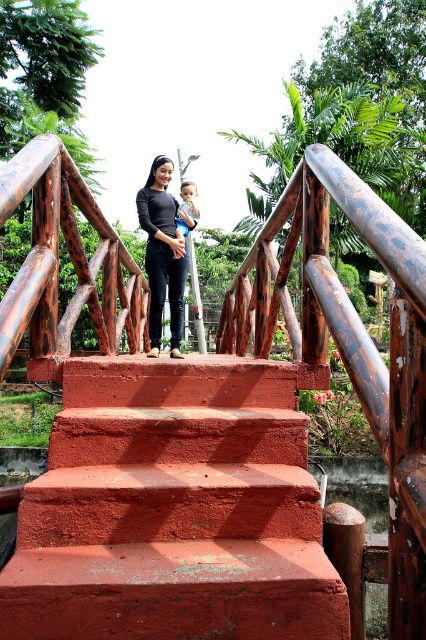
Question: Observing the image, what is the correct spatial positioning of black matte shirt at center in reference to smooth skin baby at center?

Choices:
 (A) above
 (B) below

Answer: (B)

Question: Observing the image, what is the correct spatial positioning of black matte shirt at center in reference to smooth skin baby at center?

Choices:
 (A) right
 (B) left

Answer: (B)

Question: Is smooth red concrete stairs at center to the right of black matte shirt at center from the viewer's perspective?

Choices:
 (A) yes
 (B) no

Answer: (A)

Question: Which point is farther to the camera?

Choices:
 (A) smooth skin baby at center
 (B) smooth red concrete stairs at center

Answer: (A)

Question: Which of the following is the closest to the observer?

Choices:
 (A) (166, 244)
 (B) (176, 467)

Answer: (B)

Question: Which object is farther from the camera taking this photo?

Choices:
 (A) black matte shirt at center
 (B) smooth red concrete stairs at center
 (C) smooth skin baby at center

Answer: (C)